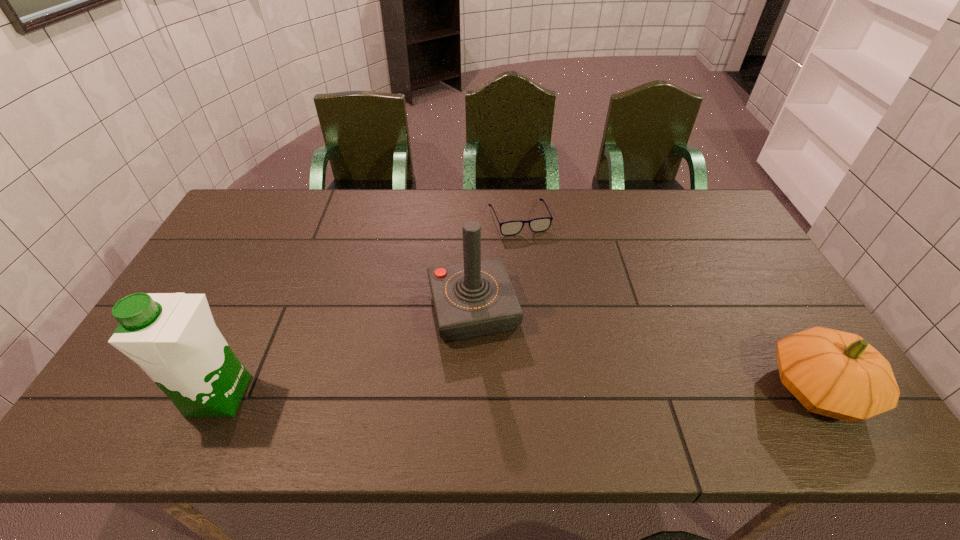
Image resolution: width=960 pixels, height=540 pixels. In order to click on vacant space situated on the front-facing side of the shortest object in this screenshot , I will do `click(559, 313)`.

This screenshot has width=960, height=540. What are the coordinates of `vacant area located 0.210m on the front-facing side of the shortest object` in the screenshot? It's located at (545, 282).

In order to click on object present at the far edge in this screenshot , I will do `click(509, 228)`.

This screenshot has height=540, width=960. I want to click on soya milk at the near edge, so click(x=173, y=337).

Locate an element on the screen. This screenshot has width=960, height=540. gourd located in the near edge section of the desktop is located at coordinates (837, 374).

I want to click on object that is positioned at the right edge, so click(837, 374).

The image size is (960, 540). In order to click on object that is at the near right corner in this screenshot , I will do `click(837, 374)`.

Where is `vacant region at the far edge of the desktop`? vacant region at the far edge of the desktop is located at coordinates (410, 204).

In the image, there is a desktop. Identify the location of free space at the near edge. (727, 396).

Image resolution: width=960 pixels, height=540 pixels. In the image, there is a desktop. In order to click on vacant space at the near left corner in this screenshot , I will do `click(116, 396)`.